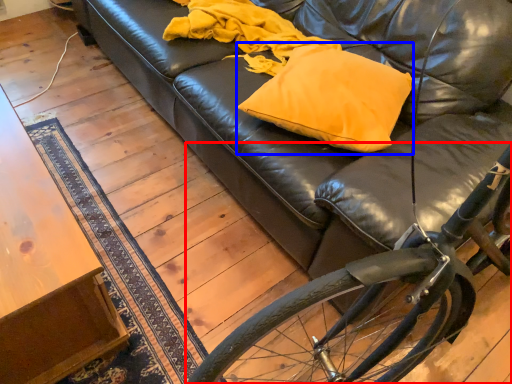
Question: Among these objects, which one is farthest to the camera, bicycle (highlighted by a red box) or throw pillow (highlighted by a blue box)?

Choices:
 (A) bicycle
 (B) throw pillow

Answer: (B)